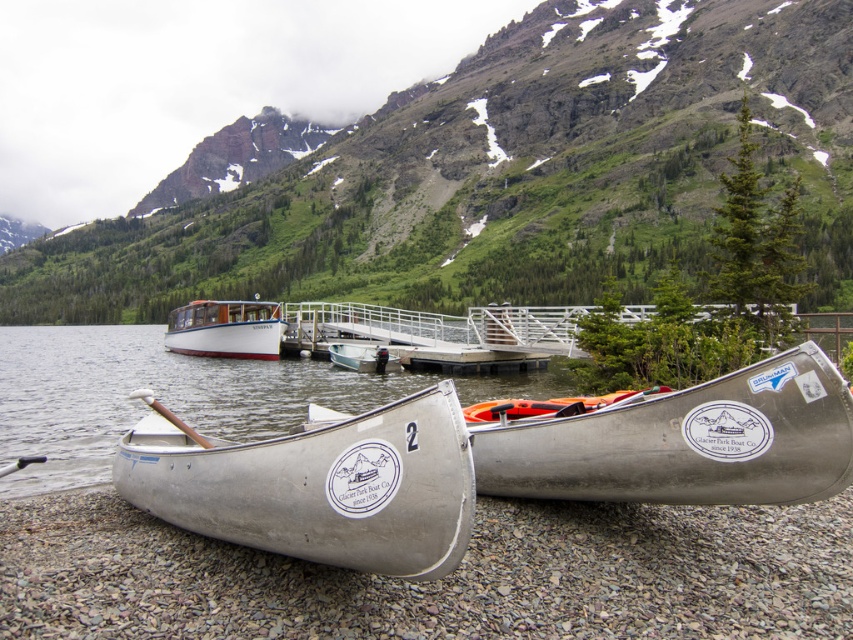
Who is lower down, white polished wood boat at center or metallic silver canoe at center?

metallic silver canoe at center is below.

Between point (271, 316) and point (344, 349), which one is positioned in front?

Point (344, 349) is more forward.

Describe the element at coordinates (225, 328) in the screenshot. Image resolution: width=853 pixels, height=640 pixels. I see `white polished wood boat at center` at that location.

Where is `white polished wood boat at center`? Image resolution: width=853 pixels, height=640 pixels. white polished wood boat at center is located at coordinates (225, 328).

Consider the image. Who is more forward, (672, 435) or (239, 300)?

Point (672, 435) is more forward.

Can you confirm if silver metallic canoe at lower right is bigger than white polished wood boat at center?

Actually, silver metallic canoe at lower right might be smaller than white polished wood boat at center.

The image size is (853, 640). What do you see at coordinates (677, 440) in the screenshot?
I see `silver metallic canoe at lower right` at bounding box center [677, 440].

Find the location of a particular element. The width and height of the screenshot is (853, 640). silver metallic canoe at lower right is located at coordinates (677, 440).

Is silver metallic canoe at lower center further to the viewer compared to white polished wood boat at center?

No, silver metallic canoe at lower center is in front of white polished wood boat at center.

Between point (459, 488) and point (245, 342), which one is positioned behind?

The point (245, 342) is more distant.

You are a GUI agent. You are given a task and a screenshot of the screen. Output one action in this format:
    pyautogui.click(x=<x>, y=<y>)
    Task: Click on the silver metallic canoe at lower center
    The height and width of the screenshot is (640, 853).
    Given the screenshot: What is the action you would take?
    pyautogui.click(x=317, y=484)